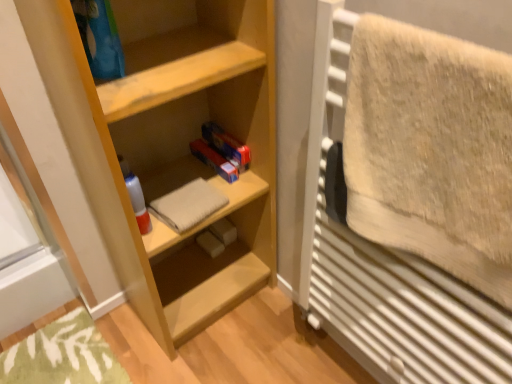
Question: Considering the relative sizes of beige cotton towel at center, the 2th bath towel viewed from the right, and beige fluffy towel at right, acting as the 1th bath towel starting from the right, in the image provided, is beige cotton towel at center, the 2th bath towel viewed from the right, bigger than beige fluffy towel at right, acting as the 1th bath towel starting from the right,?

Choices:
 (A) no
 (B) yes

Answer: (A)

Question: Can you confirm if beige cotton towel at center, acting as the 2th bath towel starting from the front, is thinner than beige fluffy towel at right, which appears as the second bath towel when viewed from the left?

Choices:
 (A) no
 (B) yes

Answer: (A)

Question: Can you confirm if beige cotton towel at center, which appears as the first bath towel when viewed from the left, is smaller than beige fluffy towel at right, acting as the 1th bath towel starting from the right?

Choices:
 (A) yes
 (B) no

Answer: (A)

Question: Considering the relative sizes of beige cotton towel at center, the 2th bath towel viewed from the right, and beige fluffy towel at right, which is the 2th bath towel in back-to-front order, in the image provided, is beige cotton towel at center, the 2th bath towel viewed from the right, wider than beige fluffy towel at right, which is the 2th bath towel in back-to-front order,?

Choices:
 (A) no
 (B) yes

Answer: (B)

Question: Considering the relative sizes of beige cotton towel at center, which appears as the first bath towel when viewed from the left, and beige fluffy towel at right, which appears as the second bath towel when viewed from the left, in the image provided, is beige cotton towel at center, which appears as the first bath towel when viewed from the left, taller than beige fluffy towel at right, which appears as the second bath towel when viewed from the left,?

Choices:
 (A) yes
 (B) no

Answer: (B)

Question: Is beige cotton towel at center, which appears as the first bath towel when viewed from the left, facing away from beige fluffy towel at right, which appears as the second bath towel when viewed from the left?

Choices:
 (A) yes
 (B) no

Answer: (B)

Question: Considering the relative positions of beige fluffy towel at right, acting as the 1th bath towel starting from the right, and beige cotton towel at center, the 2th bath towel viewed from the right, in the image provided, is beige fluffy towel at right, acting as the 1th bath towel starting from the right, in front of beige cotton towel at center, the 2th bath towel viewed from the right,?

Choices:
 (A) yes
 (B) no

Answer: (A)

Question: From a real-world perspective, is beige fluffy towel at right, which ranks as the 1th bath towel in front-to-back order, positioned over beige cotton towel at center, which is counted as the first bath towel, starting from the back, based on gravity?

Choices:
 (A) yes
 (B) no

Answer: (A)

Question: Does beige fluffy towel at right, which is the 2th bath towel in back-to-front order, appear on the right side of beige cotton towel at center, the 2th bath towel viewed from the right?

Choices:
 (A) no
 (B) yes

Answer: (B)

Question: From the image's perspective, is beige fluffy towel at right, which is the 2th bath towel in back-to-front order, on top of beige cotton towel at center, which appears as the first bath towel when viewed from the left?

Choices:
 (A) yes
 (B) no

Answer: (A)

Question: Is beige fluffy towel at right, which ranks as the 1th bath towel in front-to-back order, bigger than beige cotton towel at center, which appears as the first bath towel when viewed from the left?

Choices:
 (A) yes
 (B) no

Answer: (A)

Question: Is beige fluffy towel at right, which is the 2th bath towel in back-to-front order, at the left side of beige cotton towel at center, the 2th bath towel viewed from the right?

Choices:
 (A) yes
 (B) no

Answer: (B)

Question: Does light wood shelf at center have a larger size compared to beige fluffy towel at right, which is the 2th bath towel in back-to-front order?

Choices:
 (A) no
 (B) yes

Answer: (B)